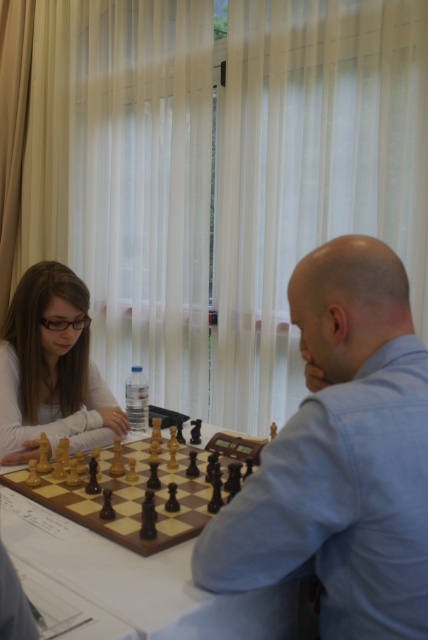
Can you confirm if wooden chessboard at center is shorter than matte black hair at left?

Yes.

Who is shorter, wooden chessboard at center or matte black hair at left?

wooden chessboard at center is shorter.

Identify the location of wooden chessboard at center. (145, 588).

Which is below, light blue shirt at center or matte black hair at left?

light blue shirt at center

Can you confirm if light blue shirt at center is shorter than matte black hair at left?

Incorrect, light blue shirt at center's height does not fall short of matte black hair at left's.

Does point (395, 554) come behind point (61, 435)?

No.

I want to click on light blue shirt at center, so click(341, 456).

At what (x,y) coordinates should I click in order to perform the action: click on light blue shirt at center. Please return your answer as a coordinate pair (x, y). This screenshot has height=640, width=428. Looking at the image, I should click on point(341,456).